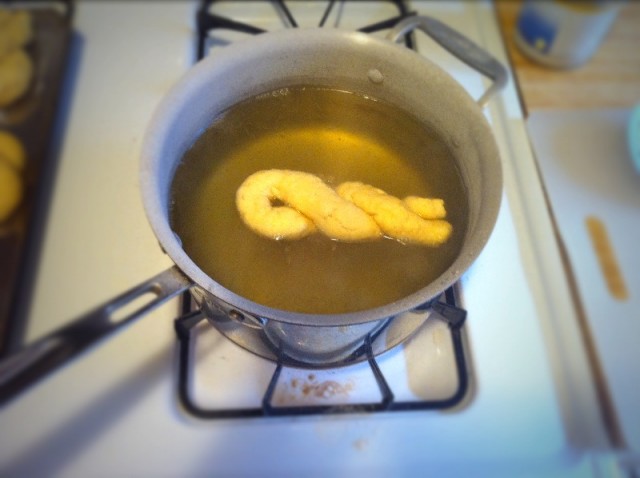
This screenshot has height=478, width=640. I want to click on stove grates, so click(372, 24), click(384, 383).